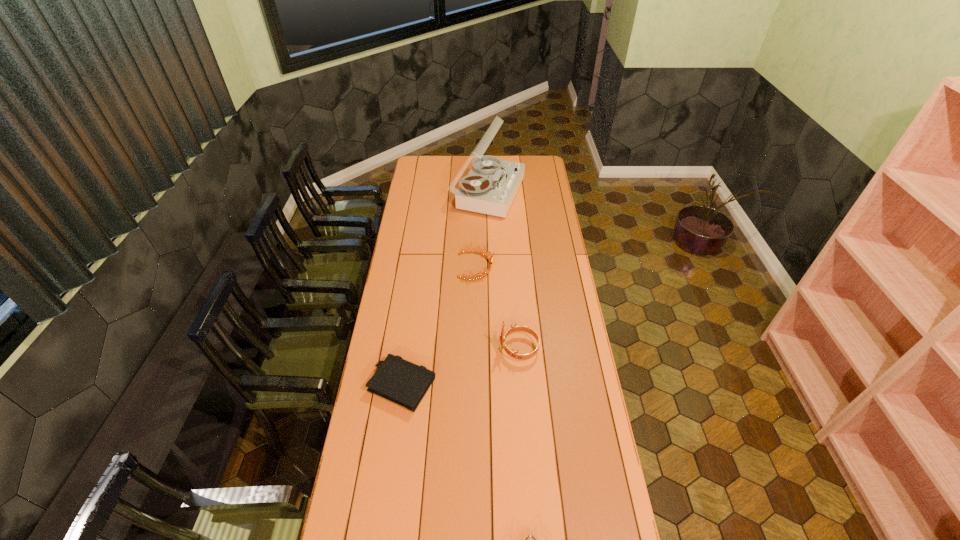
Image resolution: width=960 pixels, height=540 pixels. Find the location of `the farthest object`. the farthest object is located at coordinates (490, 187).

Where is `record player`? The height and width of the screenshot is (540, 960). record player is located at coordinates (490, 187).

Identify the location of the second nearest tiara. This screenshot has height=540, width=960. (515, 328).

Identify the location of the second tallest object. This screenshot has width=960, height=540. (515, 328).

You are a GUI agent. You are given a task and a screenshot of the screen. Output one action in this format:
    pyautogui.click(x=<x>, y=<y>)
    Task: Click on the farthest tiara
    
    Given the screenshot: What is the action you would take?
    pyautogui.click(x=486, y=255)

Locate an element on the screen. This screenshot has width=960, height=540. the second tallest tiara is located at coordinates (486, 255).

At what (x,y) coordinates should I click in order to perform the action: click on Bible. Please return your answer as a coordinate pair (x, y). Looking at the image, I should click on (400, 381).

Identify the location of free location located 0.170m on the back of the tallest object. This screenshot has width=960, height=540. (487, 156).

This screenshot has height=540, width=960. I want to click on vacant position located 0.150m on the front-facing side of the fourth shortest object, so click(x=462, y=349).

I want to click on vacant area situated on the front-facing side of the fourth shortest object, so click(x=467, y=349).